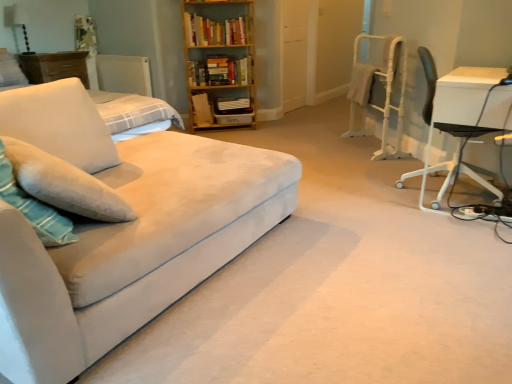
Question: In which direction should I rotate to look at wooden bookshelf at upper center, which is counted as the second book, starting from the bottom?

Choices:
 (A) right
 (B) left

Answer: (B)

Question: Is white metal computer chair at right at the right side of wooden dresser at upper left?

Choices:
 (A) no
 (B) yes

Answer: (B)

Question: Is white metal computer chair at right outside of wooden dresser at upper left?

Choices:
 (A) yes
 (B) no

Answer: (A)

Question: Does white metal computer chair at right turn towards wooden dresser at upper left?

Choices:
 (A) yes
 (B) no

Answer: (A)

Question: From the image's perspective, is white metal computer chair at right on top of wooden dresser at upper left?

Choices:
 (A) yes
 (B) no

Answer: (B)

Question: Is wooden dresser at upper left located within white metal computer chair at right?

Choices:
 (A) yes
 (B) no

Answer: (B)

Question: Is white metal computer chair at right taller than wooden dresser at upper left?

Choices:
 (A) yes
 (B) no

Answer: (A)

Question: Is suede-like beige couch at left turned away from white soft pillow at left, the second pillow positioned from the top?

Choices:
 (A) yes
 (B) no

Answer: (A)

Question: From the image's perspective, is suede-like beige couch at left on top of white soft pillow at left, the second pillow positioned from the top?

Choices:
 (A) yes
 (B) no

Answer: (B)

Question: From a real-world perspective, is suede-like beige couch at left physically above white soft pillow at left, which is counted as the first pillow, starting from the front?

Choices:
 (A) yes
 (B) no

Answer: (B)

Question: Is suede-like beige couch at left not close to white soft pillow at left, which is counted as the first pillow, starting from the front?

Choices:
 (A) yes
 (B) no

Answer: (B)

Question: From a real-world perspective, is suede-like beige couch at left under white soft pillow at left, which ranks as the 1th pillow in bottom-to-top order?

Choices:
 (A) no
 (B) yes

Answer: (B)

Question: Can you confirm if suede-like beige couch at left is shorter than white soft pillow at left, which ranks as the 1th pillow in bottom-to-top order?

Choices:
 (A) no
 (B) yes

Answer: (A)

Question: Can you confirm if white fabric lampshade at upper left is shorter than white soft pillow at left, which is counted as the first pillow, starting from the front?

Choices:
 (A) no
 (B) yes

Answer: (A)